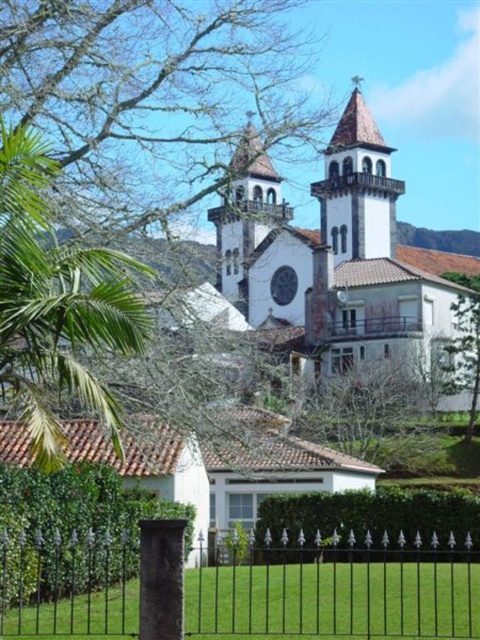
You are standing in front of the church and want to take a photo that includes both the white stucco church at center and the green leafy palm tree at center. Which object will appear larger in the photo?

The white stucco church at center is taller than the green leafy palm tree at center, so it will appear larger in the photo.

You are standing in front of the church and want to determine the relative positions of two points marked in the scene. Which point is closer to you, point (249, 147) or point (9, 596)?

Point (249, 147) is closer to you because it is further to the viewer than point (9, 596).

You are standing in front of the church and want to take a photo that includes both the green leafy hedge at lower left and the brown tiled spire at upper center. Based on their positions, where should you position the hedge relative to the spire in your camera frame?

The green leafy hedge at lower left is located below the brown tiled spire at upper center, so in your camera frame, the hedge should be positioned below the spire to include both in the photo.